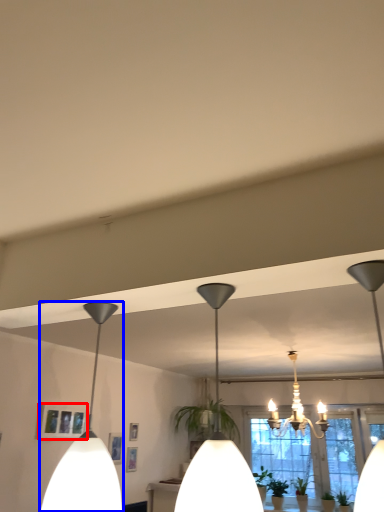
Question: Which object is closer to the camera taking this photo, picture frame (highlighted by a red box) or lamp (highlighted by a blue box)?

Choices:
 (A) picture frame
 (B) lamp

Answer: (B)